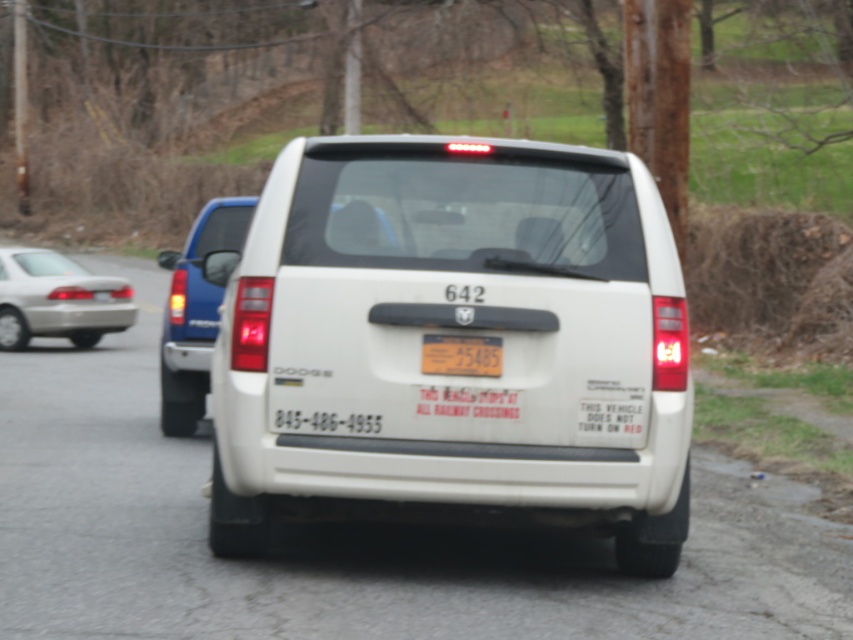
You are standing in front of the white Dodge vehicle at the railway crossing. There are two points marked on the back of the vehicle. Which of the two points, point (207, 211) or point (28, 314), is closer to you?

Point (207, 211) is closer to the viewer than point (28, 314).

You are a delivery driver who needs to load a package into the trunk of the white matte minivan at center. The metallic reflective license plate at center is blocking access to the trunk. Can you estimate if there is enough space between the license plate and the trunk opening to place the package?

The distance between the white matte minivan at center and the metallic reflective license plate at center is 12.53 feet. Since the license plate is attached to the rear of the vehicle, the trunk opening is likely positioned behind the license plate. Therefore, the license plate itself is part of the vehicle and does not block access to the trunk. The package can be placed in the trunk without any obstruction from the license plate.